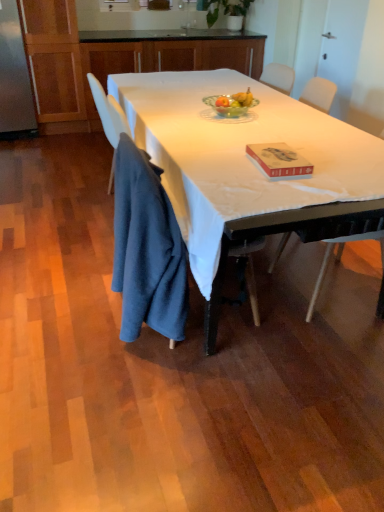
Measure the distance between point (172, 174) and camera.

A distance of 5.95 feet exists between point (172, 174) and camera.

Where is `wooden cabinets at upper center, placed as the 2th cabinetry when sorted from bottom to top`? Image resolution: width=384 pixels, height=512 pixels. wooden cabinets at upper center, placed as the 2th cabinetry when sorted from bottom to top is located at coordinates (171, 51).

The width and height of the screenshot is (384, 512). Identify the location of white plastic chair at right. (319, 94).

In terms of size, does green leafy plant at upper center appear bigger or smaller than green glass bowl at center?

In the image, green leafy plant at upper center appears to be larger than green glass bowl at center.

Is point (239, 3) more distant than point (224, 111)?

Yes, point (239, 3) is behind point (224, 111).

Does green leafy plant at upper center turn towards green glass bowl at center?

Yes, green leafy plant at upper center is turned towards green glass bowl at center.

Is green leafy plant at upper center next to green glass bowl at center and touching it?

green leafy plant at upper center and green glass bowl at center are clearly separated.

From the image's perspective, which one is positioned lower, green glass bowl at center or red matte book at center?

red matte book at center, from the image's perspective.

Which is behind, point (209, 103) or point (276, 173)?

Positioned behind is point (209, 103).

Considering the sizes of objects green glass bowl at center and red matte book at center in the image provided, who is thinner, green glass bowl at center or red matte book at center?

Thinner between the two is green glass bowl at center.

In the scene shown: Choose the correct answer: Is green glass bowl at center inside red matte book at center or outside it?

green glass bowl at center is located beyond the bounds of red matte book at center.

Between white matte table at center and white glossy sink at upper center, which one has larger size?

Bigger between the two is white matte table at center.

At what (x,y) coordinates should I click in order to perform the action: click on desk below the white glossy sink at upper center (from the image's perspective). Please return your answer as a coordinate pair (x, y). Image resolution: width=384 pixels, height=512 pixels. Looking at the image, I should click on (243, 158).

In the image, is white matte table at center on the left side or the right side of white glossy sink at upper center?

In the image, white matte table at center appears on the right side of white glossy sink at upper center.

Considering the sizes of objects white matte table at center and white glossy sink at upper center in the image provided, who is shorter, white matte table at center or white glossy sink at upper center?

white glossy sink at upper center.

Is green glass bowl at center looking in the opposite direction of wooden cabinets at upper center, placed as the 2th cabinetry when sorted from bottom to top?

Yes, green glass bowl at center is facing away from wooden cabinets at upper center, placed as the 2th cabinetry when sorted from bottom to top.

Between green glass bowl at center and wooden cabinets at upper center, acting as the first cabinetry starting from the top, which one has smaller size?

green glass bowl at center is smaller.

Between green glass bowl at center and wooden cabinets at upper center, placed as the 2th cabinetry when sorted from bottom to top, which one has less height?

green glass bowl at center.

Find the location of a particular element. The image size is (384, 512). sink that appears above the wooden cabinets at upper center, acting as the first cabinetry starting from the top (from a real-world perspective) is located at coordinates (188, 14).

Does white glossy sink at upper center have a greater height compared to wooden cabinets at upper center, acting as the first cabinetry starting from the top?

No.

Are white glossy sink at upper center and wooden cabinets at upper center, placed as the 2th cabinetry when sorted from bottom to top, making contact?

→ No, white glossy sink at upper center is not next to wooden cabinets at upper center, placed as the 2th cabinetry when sorted from bottom to top.

Which object is further away from the camera taking this photo, white glossy sink at upper center or wooden cabinets at upper center, placed as the 2th cabinetry when sorted from bottom to top?

white glossy sink at upper center is further from the camera.

Is wooden cabinets at upper center, acting as the first cabinetry starting from the top, positioned with its back to wooden cabinet at upper center, which appears as the 2th cabinetry when viewed from the top?

Yes, wooden cabinet at upper center, which appears as the 2th cabinetry when viewed from the top, is at the back of wooden cabinets at upper center, acting as the first cabinetry starting from the top.

Based on the photo, considering the relative positions of wooden cabinets at upper center, placed as the 2th cabinetry when sorted from bottom to top, and wooden cabinet at upper center, positioned as the 1th cabinetry in bottom-to-top order, in the image provided, is wooden cabinets at upper center, placed as the 2th cabinetry when sorted from bottom to top, to the right of wooden cabinet at upper center, positioned as the 1th cabinetry in bottom-to-top order, from the viewer's perspective?

Yes, wooden cabinets at upper center, placed as the 2th cabinetry when sorted from bottom to top, is to the right of wooden cabinet at upper center, positioned as the 1th cabinetry in bottom-to-top order.

Is wooden cabinets at upper center, placed as the 2th cabinetry when sorted from bottom to top, further to camera compared to wooden cabinet at upper center, positioned as the 1th cabinetry in bottom-to-top order?

That is True.

Is wooden cabinets at upper center, placed as the 2th cabinetry when sorted from bottom to top, placed right next to wooden cabinet at upper center, positioned as the 1th cabinetry in bottom-to-top order?

Yes, wooden cabinets at upper center, placed as the 2th cabinetry when sorted from bottom to top, is right next to wooden cabinet at upper center, positioned as the 1th cabinetry in bottom-to-top order, and making contact.

Which object is further away from the camera, white matte table at center or white plastic chair at right?

white plastic chair at right is behind.

You are a GUI agent. You are given a task and a screenshot of the screen. Output one action in this format:
    pyautogui.click(x=<x>, y=<y>)
    Task: Click on the chair beneath the white matte table at center (from a real-world perspective)
    
    Given the screenshot: What is the action you would take?
    pyautogui.click(x=319, y=94)

From a real-world perspective, is white matte table at center on white plastic chair at right?

Indeed, from a real-world perspective, white matte table at center stands above white plastic chair at right.

Can you tell me how much white matte table at center and white plastic chair at right differ in facing direction?

3.17 degrees.

Find the location of `houseplant behind the green glass bowl at center`. houseplant behind the green glass bowl at center is located at coordinates (226, 11).

Where is `bowl on the left of red matte book at center`? This screenshot has height=512, width=384. bowl on the left of red matte book at center is located at coordinates (229, 106).

From the image, which object appears to be farther from red matte book at center, wooden cabinets at upper center, placed as the 2th cabinetry when sorted from bottom to top, or white glossy sink at upper center?

white glossy sink at upper center is positioned further to the anchor red matte book at center.

Considering their positions, is wooden cabinets at upper center, acting as the first cabinetry starting from the top, positioned further to white matte table at center than wooden cabinet at upper center, positioned as the 1th cabinetry in bottom-to-top order?

wooden cabinet at upper center, positioned as the 1th cabinetry in bottom-to-top order, lies further to white matte table at center than the other object.

In the scene shown: Estimate the real-world distances between objects in this image. Which object is closer to wooden cabinets at upper center, placed as the 2th cabinetry when sorted from bottom to top, green glass bowl at center or white plastic chair at right?

white plastic chair at right.

From the image, which object appears to be farther from wooden cabinet at upper center, positioned as the 1th cabinetry in bottom-to-top order, wooden cabinets at upper center, acting as the first cabinetry starting from the top, or dark blue fabric at lower left?

Based on the image, dark blue fabric at lower left appears to be further to wooden cabinet at upper center, positioned as the 1th cabinetry in bottom-to-top order.

Which object lies nearer to the anchor point dark blue fabric at lower left, white glossy sink at upper center or white matte table at center?

Based on the image, white matte table at center appears to be nearer to dark blue fabric at lower left.

From the image, which object appears to be nearer to white matte table at center, white plastic chair at right or red matte book at center?

red matte book at center is closer to white matte table at center.

Which object lies nearer to the anchor point white glossy sink at upper center, dark blue fabric at lower left or green leafy plant at upper center?

green leafy plant at upper center is positioned closer to the anchor white glossy sink at upper center.

Looking at the image, which one is located further to wooden cabinets at upper center, acting as the first cabinetry starting from the top, green glass bowl at center or white matte table at center?

green glass bowl at center.

Locate an element on the screen. cloth between white matte table at center and wooden cabinets at upper center, acting as the first cabinetry starting from the top, from front to back is located at coordinates (147, 249).

Identify the location of book situated between dark blue fabric at lower left and white plastic chair at right from left to right. This screenshot has width=384, height=512. (279, 161).

Where is `cabinetry between red matte book at center and wooden cabinets at upper center, placed as the 2th cabinetry when sorted from bottom to top, from front to back`? The height and width of the screenshot is (512, 384). cabinetry between red matte book at center and wooden cabinets at upper center, placed as the 2th cabinetry when sorted from bottom to top, from front to back is located at coordinates (130, 66).

The height and width of the screenshot is (512, 384). What are the coordinates of `book between dark blue fabric at lower left and wooden cabinets at upper center, acting as the first cabinetry starting from the top, in the front-back direction` in the screenshot? It's located at (279, 161).